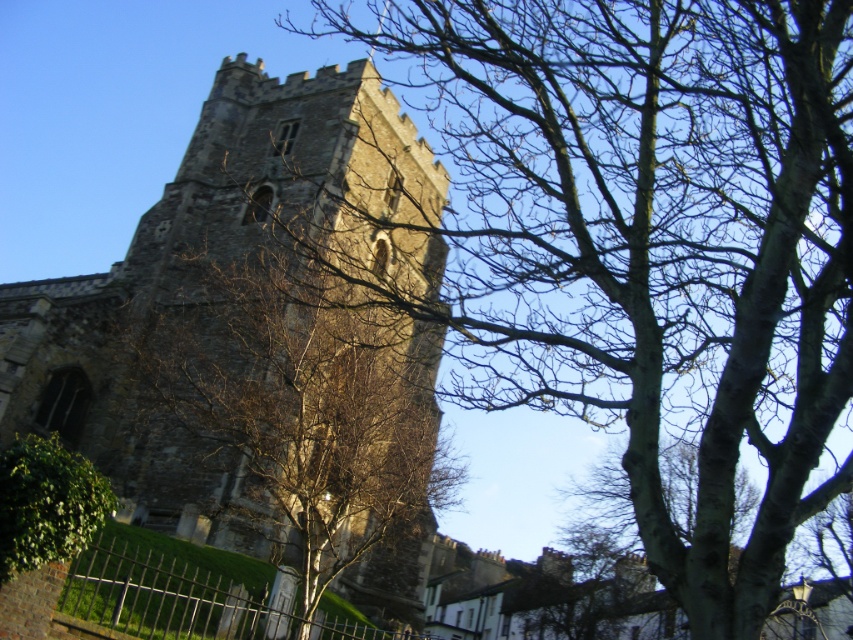
Question: Among these points, which one is nearest to the camera?

Choices:
 (A) (787, 36)
 (B) (236, 132)
 (C) (13, 449)

Answer: (A)

Question: In this image, where is brown bark tree at center located relative to green leafy bush at lower left?

Choices:
 (A) below
 (B) above

Answer: (B)

Question: Can you confirm if gray stone tower at center is thinner than green leafy bush at lower left?

Choices:
 (A) no
 (B) yes

Answer: (A)

Question: Considering the relative positions of gray stone tower at center and green leafy bush at lower left in the image provided, where is gray stone tower at center located with respect to green leafy bush at lower left?

Choices:
 (A) right
 (B) left

Answer: (A)

Question: Which point is closer to the camera?

Choices:
 (A) (78, 540)
 (B) (610, 336)

Answer: (A)

Question: Which point is farther to the camera?

Choices:
 (A) (636, 1)
 (B) (320, 196)
 (C) (41, 545)

Answer: (B)